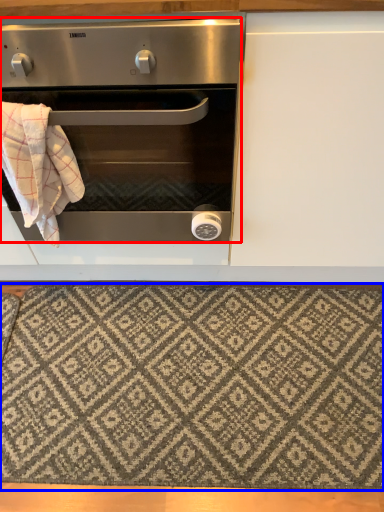
Question: Which object appears farthest to the camera in this image, oven (highlighted by a red box) or mat (highlighted by a blue box)?

Choices:
 (A) oven
 (B) mat

Answer: (B)